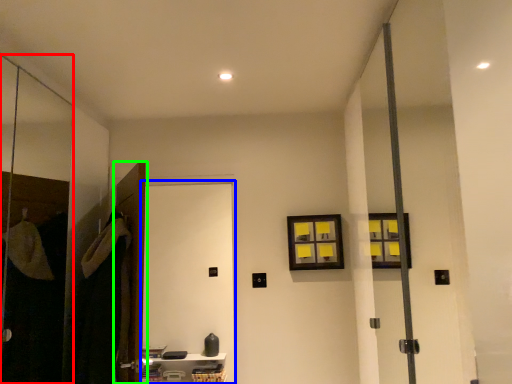
Question: Which object is the farthest from screen door (highlighted by a red box)? Choose among these: screen door (highlighted by a blue box) or door (highlighted by a green box).

Choices:
 (A) screen door
 (B) door

Answer: (A)